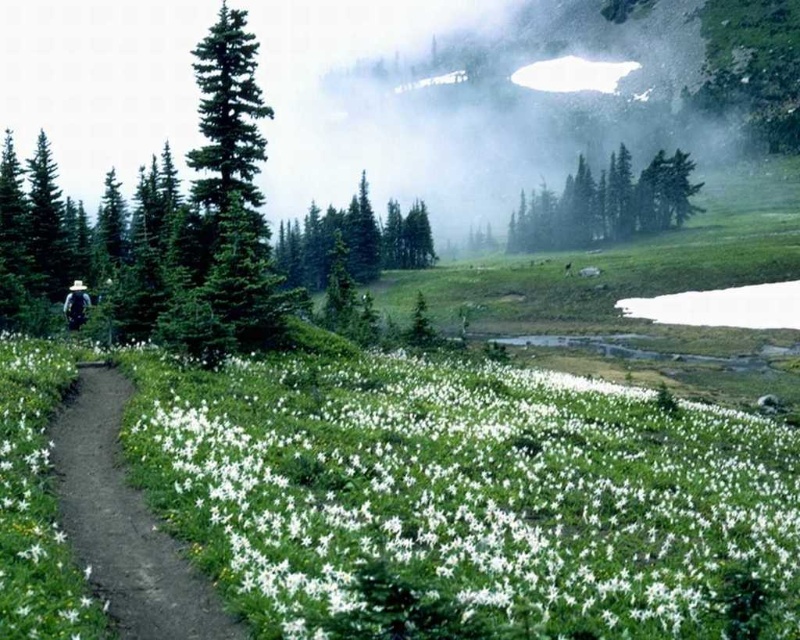
You are a hiker standing at the lower center of the image. You see the white matte flower at lower center and the green glossy evergreen tree at center. Which object is closer to you?

The white matte flower at lower center is closer to you since it is positioned under the green glossy evergreen tree at center, indicating it is in front of the tree.